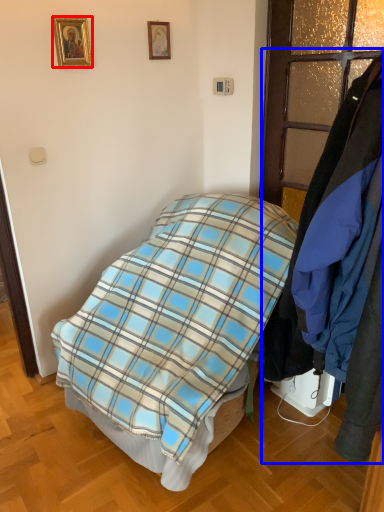
Question: Among these objects, which one is farthest to the camera, picture frame (highlighted by a red box) or closet (highlighted by a blue box)?

Choices:
 (A) picture frame
 (B) closet

Answer: (A)